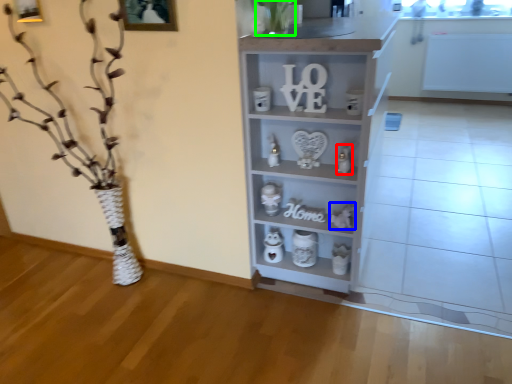
Question: Estimate the real-world distances between objects in this image. Which object is closer to toy (highlighted by a red box), toy (highlighted by a blue box) or plant (highlighted by a green box)?

Choices:
 (A) toy
 (B) plant

Answer: (A)